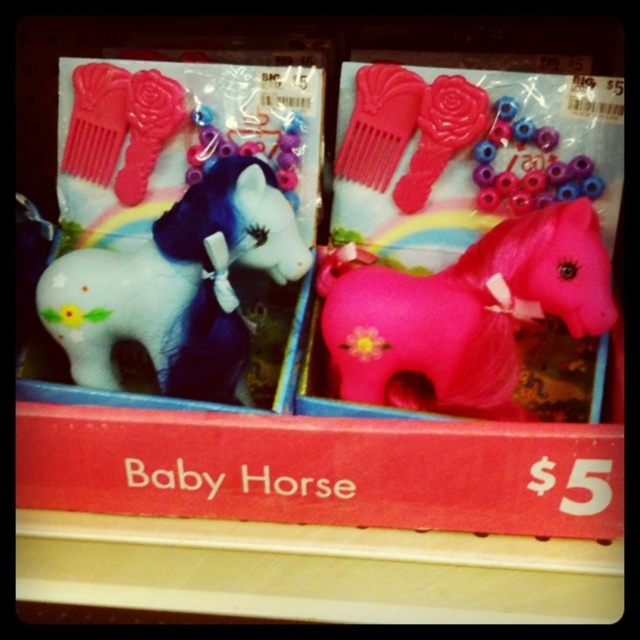
Question: Is pink matte horse at center below white matte horse at left?

Choices:
 (A) no
 (B) yes

Answer: (B)

Question: Among these points, which one is farthest from the camera?

Choices:
 (A) (220, 369)
 (B) (424, 336)

Answer: (A)

Question: Which of the following is the closest to the observer?

Choices:
 (A) white matte horse at left
 (B) pink matte horse at center

Answer: (B)

Question: Is pink matte horse at center to the right of white matte horse at left from the viewer's perspective?

Choices:
 (A) yes
 (B) no

Answer: (A)

Question: Does pink matte horse at center have a lesser width compared to white matte horse at left?

Choices:
 (A) yes
 (B) no

Answer: (B)

Question: Which object appears closest to the camera in this image?

Choices:
 (A) white matte horse at left
 (B) pink matte horse at center

Answer: (B)